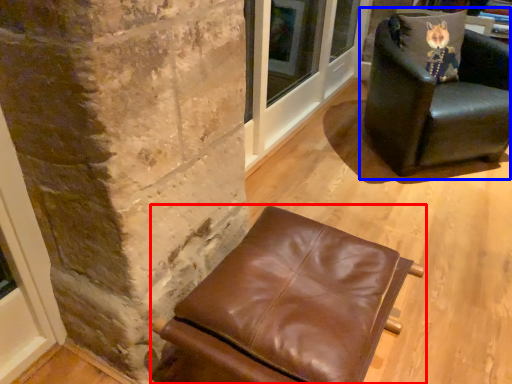
Question: Which object is closer to the camera taking this photo, chair (highlighted by a red box) or chair (highlighted by a blue box)?

Choices:
 (A) chair
 (B) chair

Answer: (A)